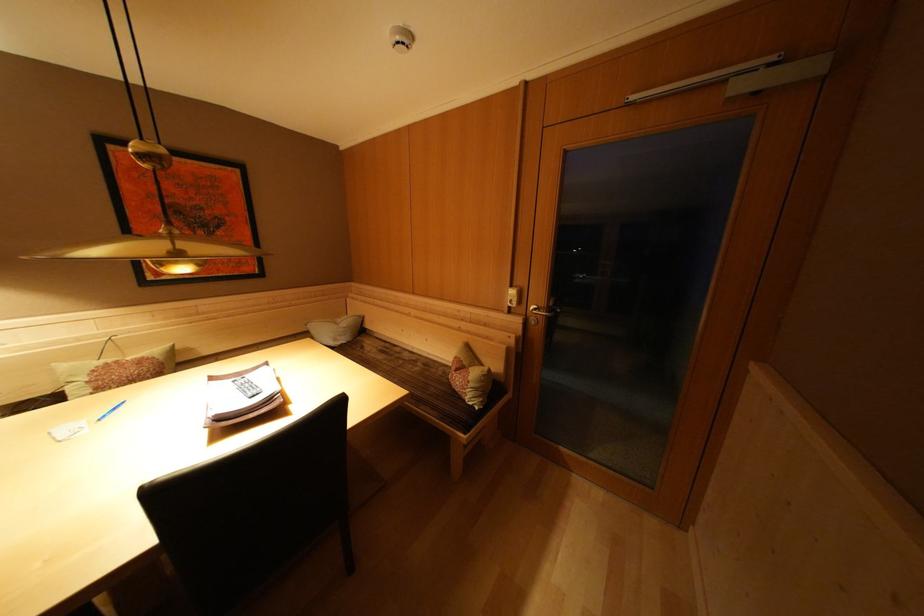
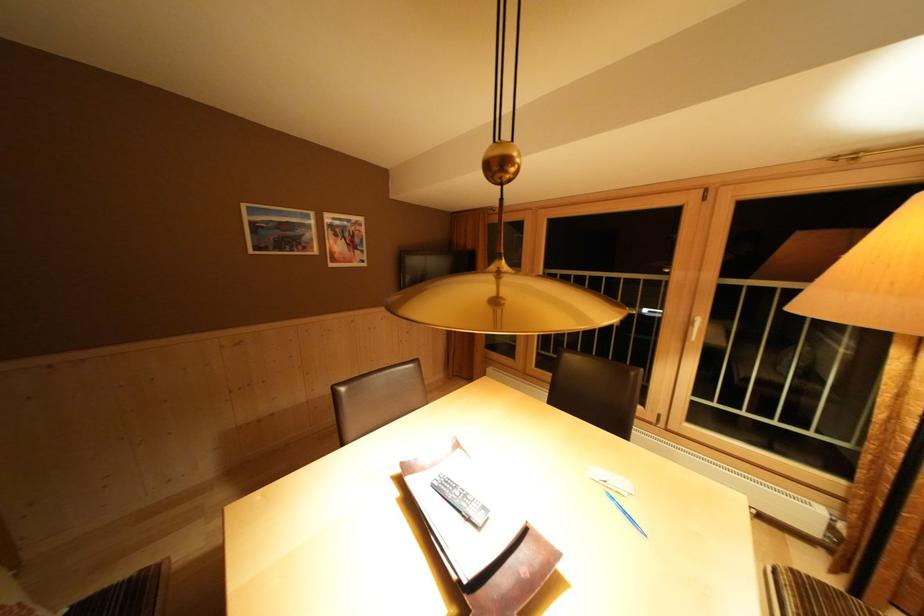
Locate, in the second image, the point that corresponds to the point at 120,415 in the first image.

(633, 517)